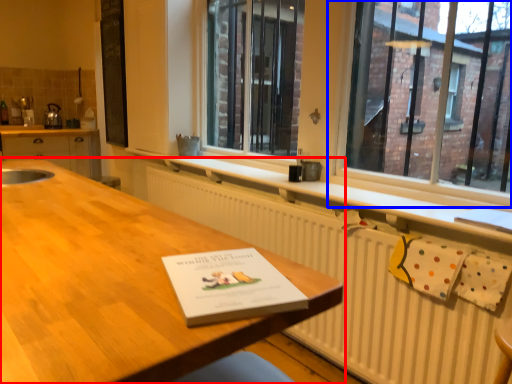
Question: Among these objects, which one is nearest to the camera, table (highlighted by a red box) or window (highlighted by a blue box)?

Choices:
 (A) table
 (B) window

Answer: (A)